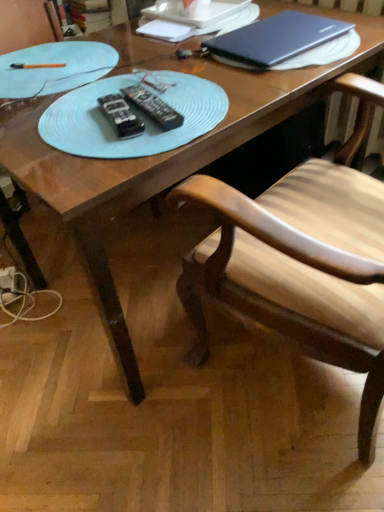
Find the location of a particular element. vacant space behind black plastic remote at center, the first remote positioned from the left is located at coordinates (121, 82).